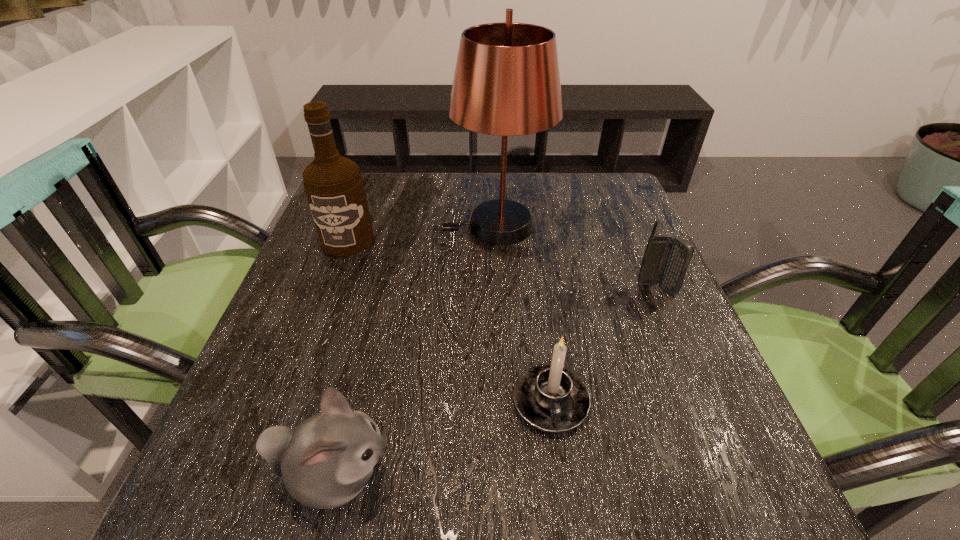
Where is `vacant region located with a handle on the side of the candle holder`? This screenshot has width=960, height=540. vacant region located with a handle on the side of the candle holder is located at coordinates (561, 478).

Where is `free space located 0.360m on the keyboard of the cellular telephone`? This screenshot has width=960, height=540. free space located 0.360m on the keyboard of the cellular telephone is located at coordinates 739,482.

The height and width of the screenshot is (540, 960). I want to click on free space located on the face of the hamster, so click(x=580, y=475).

Identify the location of object present at the far edge. (507, 82).

At what (x,y) coordinates should I click in order to perform the action: click on object at the near edge. Please return your answer as a coordinate pair (x, y). Looking at the image, I should click on (325, 462).

Where is `alcohol located at the left edge`? Image resolution: width=960 pixels, height=540 pixels. alcohol located at the left edge is located at coordinates (334, 186).

Find the location of a particular element. The width and height of the screenshot is (960, 540). hamster located in the left edge section of the desktop is located at coordinates (325, 462).

Image resolution: width=960 pixels, height=540 pixels. Identify the location of object located at the right edge. click(x=666, y=260).

Where is `object present at the near left corner`? The width and height of the screenshot is (960, 540). object present at the near left corner is located at coordinates (325, 462).

The height and width of the screenshot is (540, 960). Find the location of `free region at the far edge of the desktop`. free region at the far edge of the desktop is located at coordinates (409, 178).